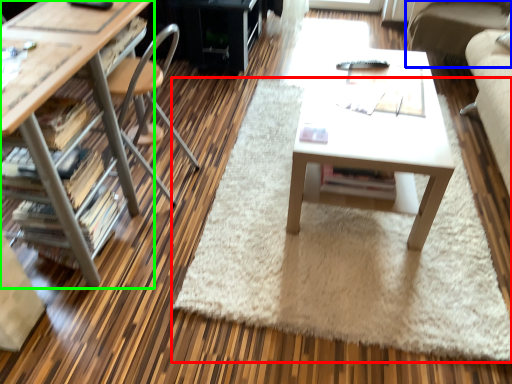
Question: Which is nearer to the mat (highlighted by a red box)? couch (highlighted by a blue box) or desk (highlighted by a green box).

Choices:
 (A) couch
 (B) desk

Answer: (B)